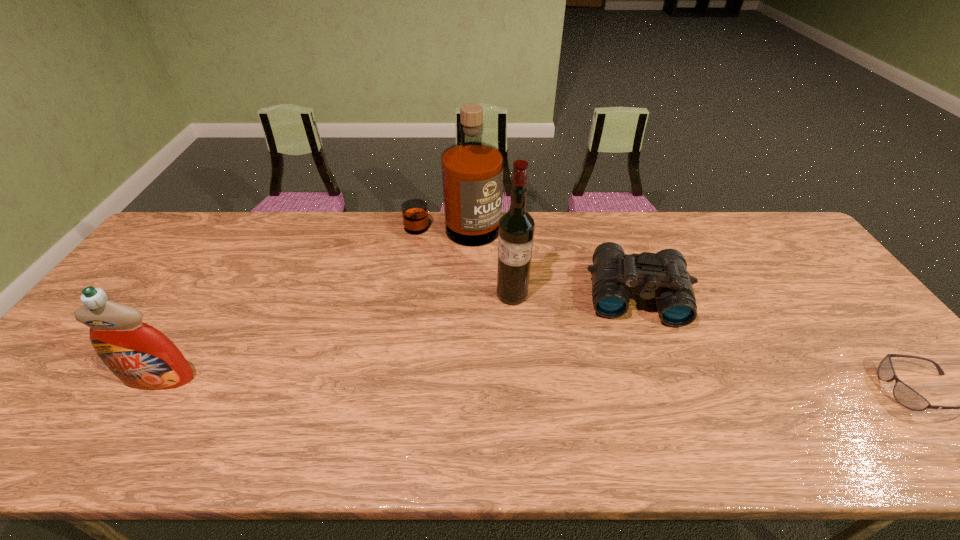
Locate an element on the screen. This screenshot has width=960, height=540. detergent is located at coordinates pos(141,356).

At what (x,y) coordinates should I click in order to perform the action: click on the third shortest object. Please return your answer as a coordinate pair (x, y). This screenshot has width=960, height=540. Looking at the image, I should click on (141, 356).

This screenshot has width=960, height=540. I want to click on wine bottle, so 516,227.

Where is `the second shortest object`? This screenshot has height=540, width=960. the second shortest object is located at coordinates 663,274.

Where is `the fourth object from left to right`? the fourth object from left to right is located at coordinates coord(663,274).

Identify the location of the farthest object. pos(472,171).

This screenshot has height=540, width=960. What are the coordinates of `vacant space located on the front and back of the wine bottle` in the screenshot? It's located at (412, 406).

Image resolution: width=960 pixels, height=540 pixels. Identify the location of blank area located on the front and back of the wine bottle. click(418, 400).

Identify the location of free region located on the front and back of the wine bottle. This screenshot has height=540, width=960. (484, 327).

Where is `vacant region located through the lenses of the second object from right to left`? This screenshot has width=960, height=540. vacant region located through the lenses of the second object from right to left is located at coordinates (643, 357).